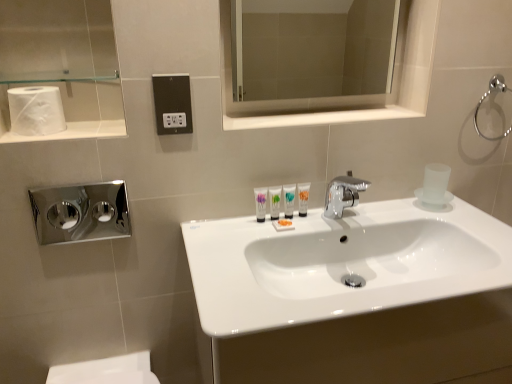
Question: Can you confirm if matte white tube at center, which appears as the first mouthwash when viewed from the left, is thinner than chrome metallic towel ring at upper right?

Choices:
 (A) yes
 (B) no

Answer: (A)

Question: Is chrome metallic towel ring at upper right at the back of matte white tube at center, which appears as the first mouthwash when viewed from the left?

Choices:
 (A) yes
 (B) no

Answer: (B)

Question: Is matte white tube at center, the second mouthwash in the right-to-left sequence, placed right next to chrome metallic towel ring at upper right?

Choices:
 (A) no
 (B) yes

Answer: (A)

Question: Is there a large distance between matte white tube at center, the second mouthwash in the right-to-left sequence, and chrome metallic towel ring at upper right?

Choices:
 (A) yes
 (B) no

Answer: (B)

Question: Does matte white tube at center, the second mouthwash in the right-to-left sequence, contain chrome metallic towel ring at upper right?

Choices:
 (A) yes
 (B) no

Answer: (B)

Question: From a real-world perspective, is matte white tube at center, the second mouthwash in the right-to-left sequence, physically below chrome metallic towel ring at upper right?

Choices:
 (A) no
 (B) yes

Answer: (B)

Question: From a real-world perspective, is translucent plastic mouthwash at center, the 2th mouthwash positioned from the left, over chrome/metallic hand dryer at left?

Choices:
 (A) yes
 (B) no

Answer: (B)

Question: Is translucent plastic mouthwash at center, the 2th mouthwash positioned from the left, to the right of chrome/metallic hand dryer at left from the viewer's perspective?

Choices:
 (A) yes
 (B) no

Answer: (A)

Question: Is translucent plastic mouthwash at center, the 2th mouthwash positioned from the left, wider than chrome/metallic hand dryer at left?

Choices:
 (A) yes
 (B) no

Answer: (B)

Question: Is translucent plastic mouthwash at center, the 2th mouthwash positioned from the left, next to chrome/metallic hand dryer at left and touching it?

Choices:
 (A) yes
 (B) no

Answer: (B)

Question: Is translucent plastic mouthwash at center, the 2th mouthwash positioned from the left, turned away from chrome/metallic hand dryer at left?

Choices:
 (A) yes
 (B) no

Answer: (B)

Question: Is chrome metallic towel ring at upper right to the right of white matte toilet paper at upper left from the viewer's perspective?

Choices:
 (A) yes
 (B) no

Answer: (A)